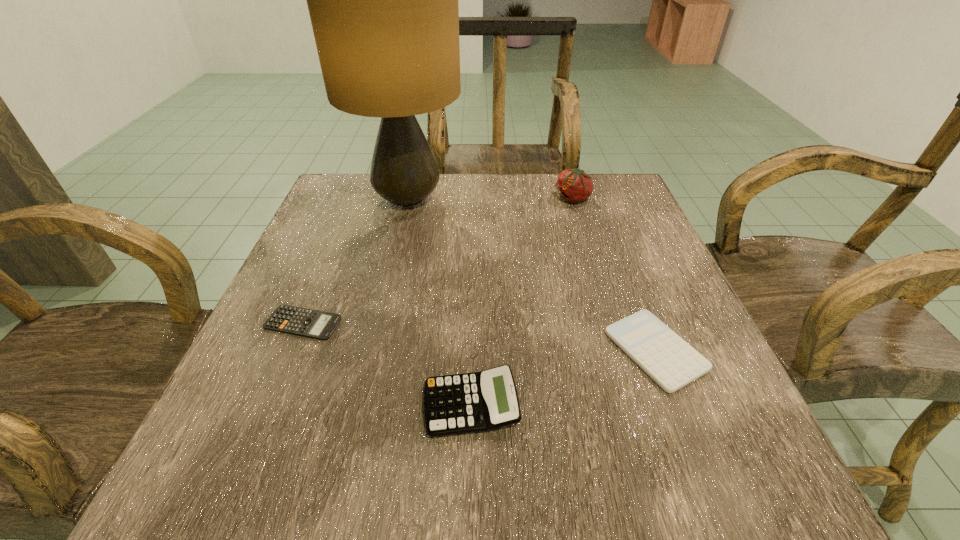
At what (x,y) coordinates should I click in order to perform the action: click on object located at the far left corner. Please return your answer as a coordinate pair (x, y). This screenshot has width=960, height=540. Looking at the image, I should click on 383,0.

What are the coordinates of `object that is at the far right corner` in the screenshot? It's located at click(x=574, y=185).

Image resolution: width=960 pixels, height=540 pixels. In the image, there is a desktop. In order to click on vacant space at the far edge in this screenshot , I will do `click(519, 199)`.

Identify the location of vacant space at the near edge. (593, 492).

Locate an element on the screen. The height and width of the screenshot is (540, 960). vacant space at the left edge is located at coordinates (339, 262).

The height and width of the screenshot is (540, 960). In the image, there is a desktop. In order to click on free space at the right edge in this screenshot , I will do `click(629, 409)`.

Find the location of `free space at the far left corner`. free space at the far left corner is located at coordinates (344, 185).

What are the coordinates of `free region at the near left corner` in the screenshot? It's located at (244, 442).

You are a GUI agent. You are given a task and a screenshot of the screen. Output one action in this format:
    pyautogui.click(x=<x>, y=<y>)
    Task: Click on the vacant area at the far right corner
    The height and width of the screenshot is (540, 960).
    Given the screenshot: What is the action you would take?
    pyautogui.click(x=601, y=178)

At what (x,y) coordinates should I click in order to perform the action: click on vacant point located between the leftmost calculator and the lampshade. Please return your answer as a coordinate pair (x, y). Image resolution: width=960 pixels, height=540 pixels. Looking at the image, I should click on (355, 261).